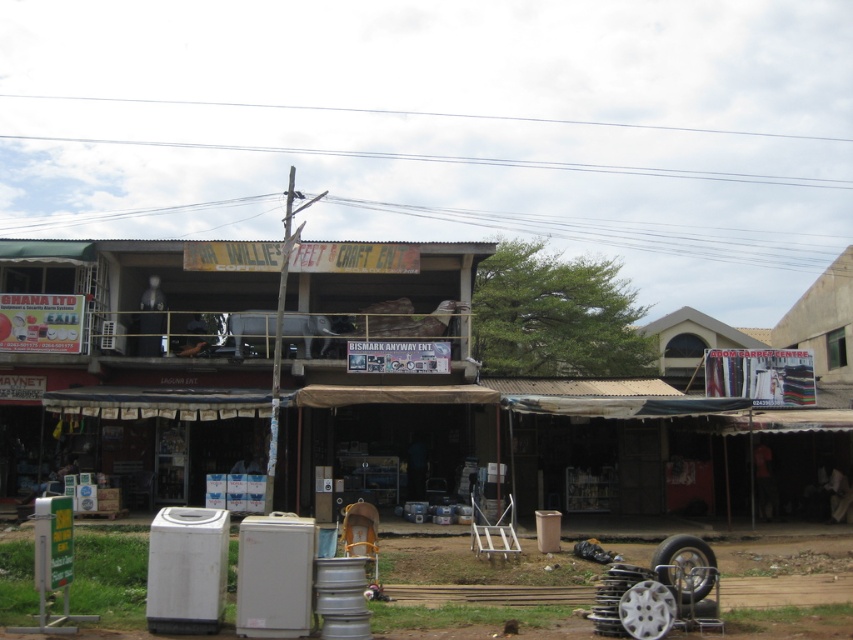
Between black rubber tire at lower right and silver metallic tire at lower center, which one appears on the left side from the viewer's perspective?

Positioned to the left is silver metallic tire at lower center.

Who is positioned more to the right, black rubber tire at lower right or silver metallic tire at lower center?

black rubber tire at lower right

Does point (676, 596) lie in front of point (675, 612)?

No, it is behind (675, 612).

Where is `black rubber tire at lower right`? The height and width of the screenshot is (640, 853). black rubber tire at lower right is located at coordinates (683, 566).

Between point (315, 324) and point (647, 592), which one is positioned in front?

Point (647, 592) is in front.

Locate an element on the screen. Image resolution: width=853 pixels, height=640 pixels. brown corrugated metal hut at center is located at coordinates (138, 362).

Which is behind, point (816, 280) or point (641, 612)?

The point (816, 280) is behind.

Can you confirm if striped fabric tent at right is positioned to the right of silver metallic tire at lower center?

Indeed, striped fabric tent at right is positioned on the right side of silver metallic tire at lower center.

At what (x,y) coordinates should I click in order to perform the action: click on striped fabric tent at right. Please return your answer as a coordinate pair (x, y). Looking at the image, I should click on (x=824, y=330).